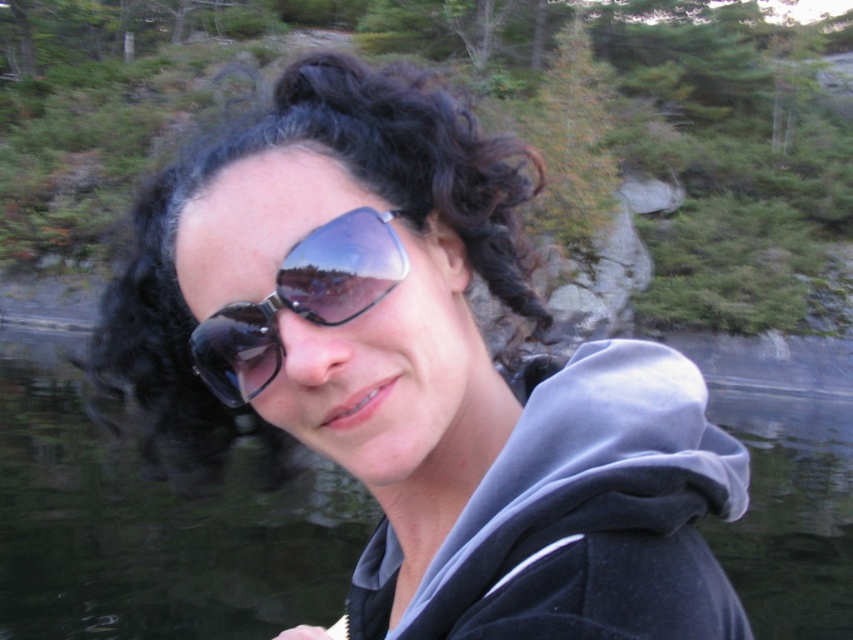
Is point (4, 326) farther from viewer compared to point (236, 365)?

Yes, it is behind point (236, 365).

Find the location of a particular element. transparent water at center is located at coordinates (151, 525).

Which is below, matte black sunglasses at center or transparent water at center?

transparent water at center

Can you confirm if matte black sunglasses at center is bigger than transparent water at center?

No.

Is point (329, 106) less distant than point (39, 536)?

Yes, point (329, 106) is in front of point (39, 536).

At what (x,y) coordinates should I click in order to perform the action: click on matte black sunglasses at center. Please return your answer as a coordinate pair (x, y). Looking at the image, I should click on (422, 371).

From the picture: Between matte black sunglasses at center and shiny black sunglasses at center, which one appears on the right side from the viewer's perspective?

matte black sunglasses at center

Find the location of a particular element. This screenshot has height=640, width=853. matte black sunglasses at center is located at coordinates (422, 371).

Locate an element on the screen. The width and height of the screenshot is (853, 640). matte black sunglasses at center is located at coordinates (422, 371).